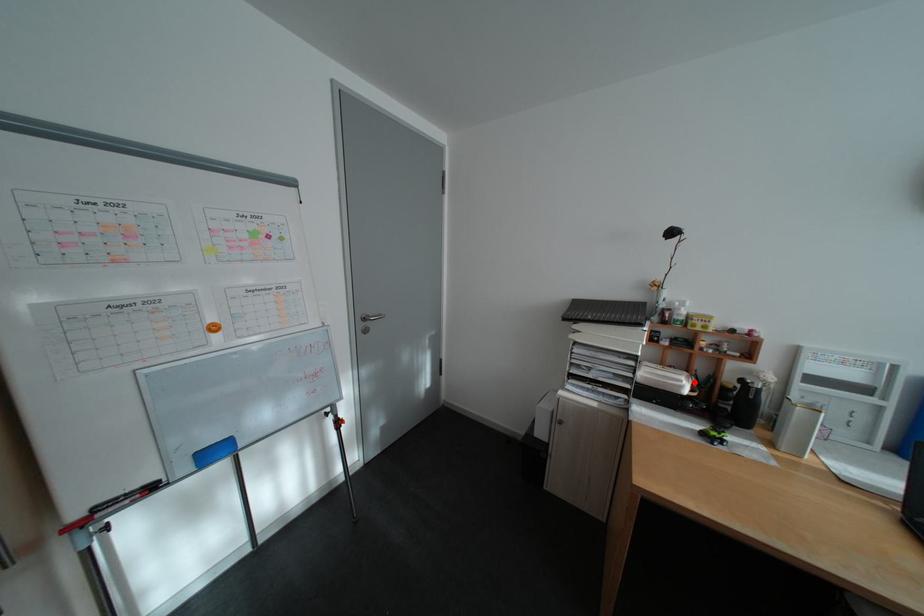
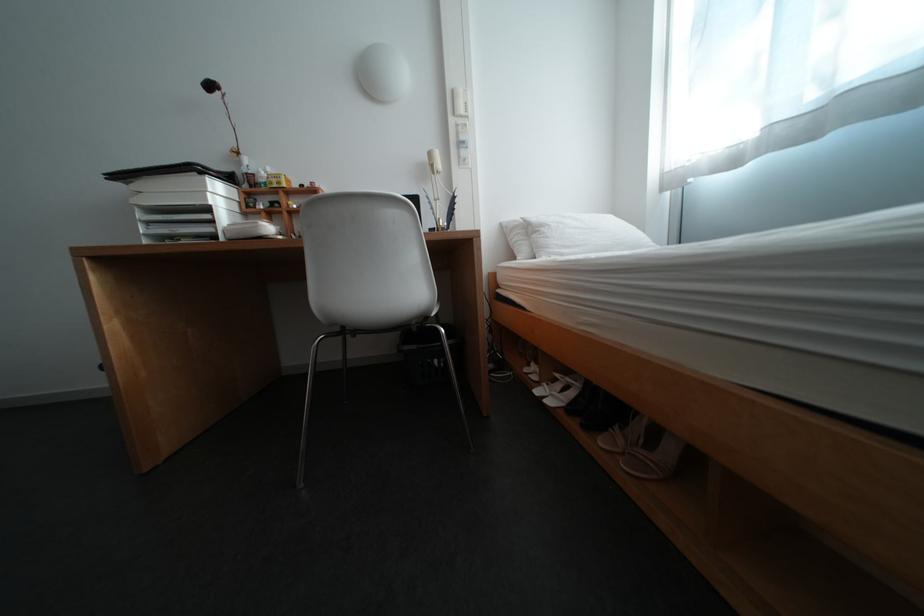
Locate, in the second image, the point that corresponds to the highlighted location in the first image.

(270, 224)